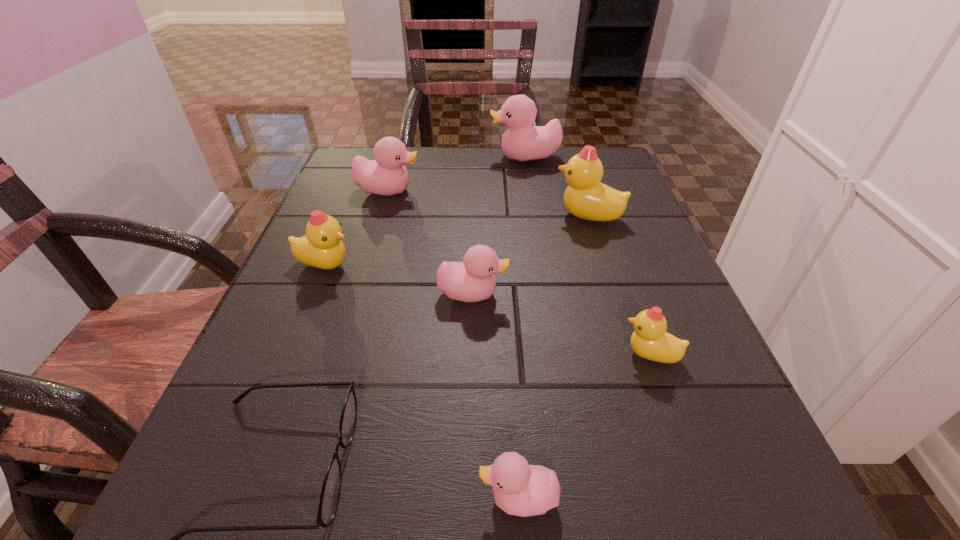
The image size is (960, 540). I want to click on object at the far left corner, so click(386, 175).

At what (x,y) coordinates should I click in order to perform the action: click on object that is at the far right corner. Please return your answer as a coordinate pair (x, y). The height and width of the screenshot is (540, 960). Looking at the image, I should click on (521, 142).

Where is `vacant space at the left edge of the desktop`? Image resolution: width=960 pixels, height=540 pixels. vacant space at the left edge of the desktop is located at coordinates (283, 301).

Image resolution: width=960 pixels, height=540 pixels. Identify the location of free space at the right edge of the desktop. 650,232.

Where is `vacant space at the far left corner`? The height and width of the screenshot is (540, 960). vacant space at the far left corner is located at coordinates (349, 159).

Image resolution: width=960 pixels, height=540 pixels. I want to click on free space at the far right corner of the desktop, so click(x=611, y=164).

You are a GUI agent. You are given a task and a screenshot of the screen. Output one action in this format:
    pyautogui.click(x=<x>, y=<y>)
    Task: Click on the vacant space at the near right corner of the desktop
    This screenshot has width=960, height=540.
    Given the screenshot: What is the action you would take?
    pyautogui.click(x=663, y=472)

This screenshot has height=540, width=960. I want to click on free spot between the smallest pink duckling and the third nearest pink duckling, so click(x=453, y=345).

The height and width of the screenshot is (540, 960). What are the coordinates of `vacant space that is in between the sixth farthest object and the nearest pink duckling` in the screenshot? It's located at (585, 427).

Locate an element on the screen. Image resolution: width=960 pixels, height=540 pixels. free point between the farthest pink duckling and the second nearest yellow duckling is located at coordinates click(x=425, y=212).